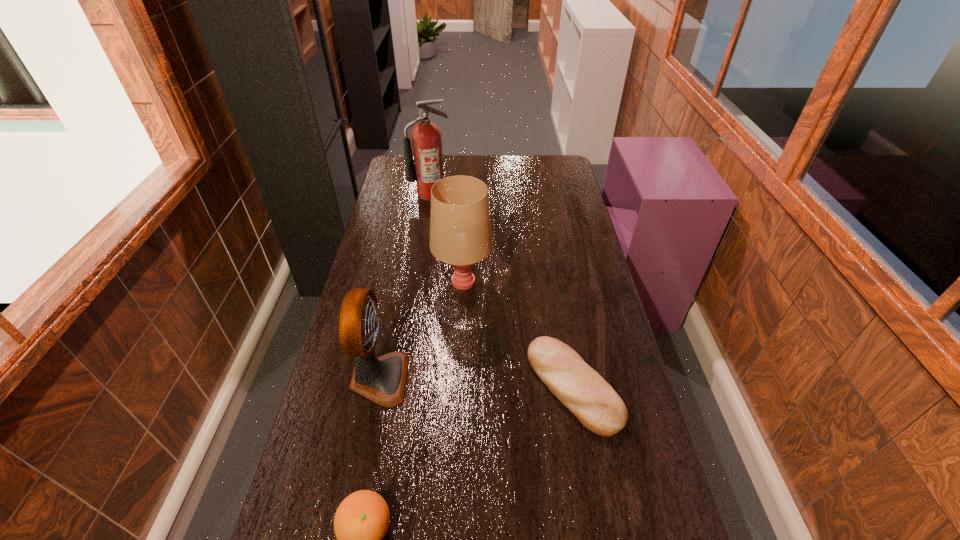
Image resolution: width=960 pixels, height=540 pixels. Find the location of `the farthest object`. the farthest object is located at coordinates (426, 169).

At what (x,y) coordinates should I click in order to perform the action: click on the fourth nearest object. Please return your answer as a coordinate pair (x, y). This screenshot has height=540, width=960. Looking at the image, I should click on (460, 226).

Find the location of a particular element. fan is located at coordinates (382, 380).

What are the coordinates of `bread` in the screenshot? It's located at (598, 407).

Identify the location of the rightmost object. This screenshot has width=960, height=540. (598, 407).

Where is `vacant region located on the front of the farthest object near the operation label`? The width and height of the screenshot is (960, 540). vacant region located on the front of the farthest object near the operation label is located at coordinates (423, 244).

This screenshot has width=960, height=540. I want to click on free space located 0.380m on the right of the second farthest object, so coord(598,282).

This screenshot has height=540, width=960. Find the location of `free space located on the front-facing side of the fan`. free space located on the front-facing side of the fan is located at coordinates (534, 379).

Where is `vacant space situated on the back of the bread`? This screenshot has height=540, width=960. vacant space situated on the back of the bread is located at coordinates [x=557, y=289].

Locate an element on the screen. The image size is (960, 540). fire extinguisher located at the left edge is located at coordinates (426, 169).